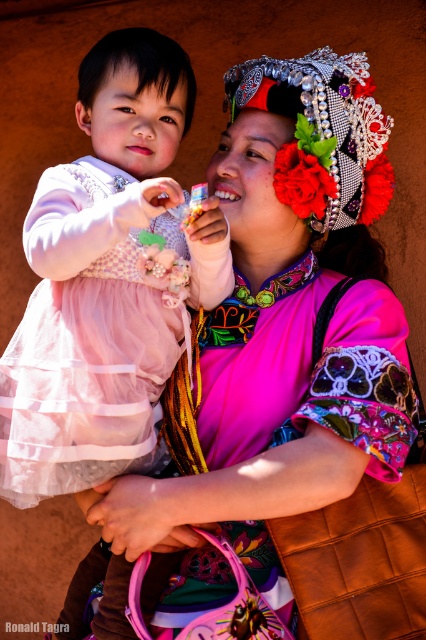
Question: Does matte pink dress at left come behind silver metallic headdress at upper center?

Choices:
 (A) no
 (B) yes

Answer: (A)

Question: Where is matte pink dress at left located in relation to silver metallic headdress at upper center in the image?

Choices:
 (A) right
 (B) left

Answer: (B)

Question: Among these objects, which one is nearest to the camera?

Choices:
 (A) matte pink dress at left
 (B) silver metallic headdress at upper center

Answer: (A)

Question: Among these points, which one is nearest to the camera?

Choices:
 (A) (319, 65)
 (B) (46, 298)

Answer: (B)

Question: Which of the following is the farthest from the observer?

Choices:
 (A) matte pink dress at left
 (B) silver metallic headdress at upper center

Answer: (B)

Question: Observing the image, what is the correct spatial positioning of matte pink dress at left in reference to silver metallic headdress at upper center?

Choices:
 (A) left
 (B) right

Answer: (A)